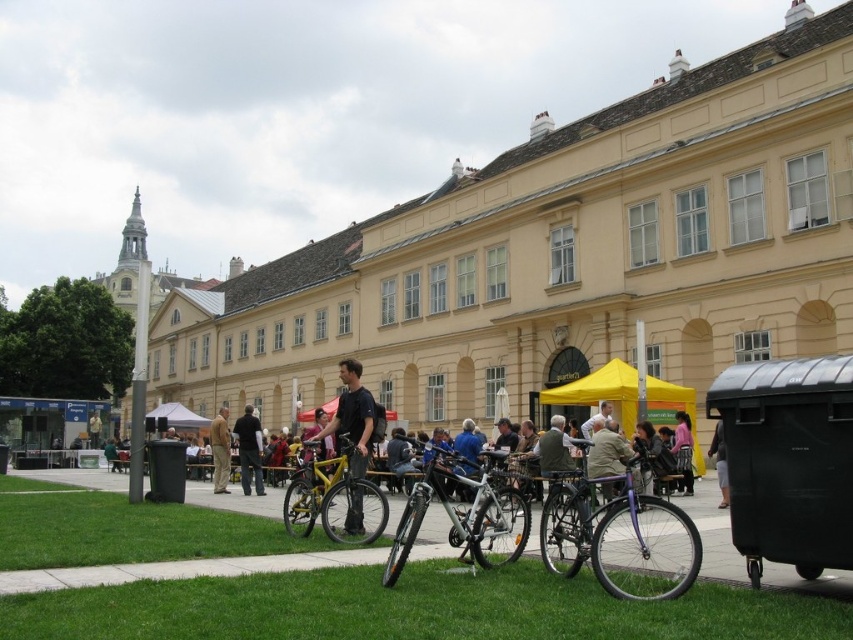
Question: Which point appears farthest from the camera in this image?

Choices:
 (A) (335, 429)
 (B) (795, 630)
 (C) (706, 486)

Answer: (C)

Question: In this image, where is shiny silver bicycle at center located relative to yellow matte bicycle at center?

Choices:
 (A) right
 (B) left

Answer: (A)

Question: From the image, what is the correct spatial relationship of matte black shirt at center in relation to dark gray jacket at center?

Choices:
 (A) right
 (B) left

Answer: (A)

Question: Estimate the real-world distances between objects in this image. Which object is closer to the matte black bicycle at center?

Choices:
 (A) yellow matte bicycle at center
 (B) tan leather jacket at center

Answer: (A)

Question: Does smooth concrete pavement at center have a smaller size compared to tan leather jacket at center?

Choices:
 (A) no
 (B) yes

Answer: (A)

Question: Which object appears farthest from the camera in this image?

Choices:
 (A) dark gray fabric pants at lower right
 (B) yellow matte bicycle at center
 (C) matte black shirt at center
 (D) shiny silver bicycle at center

Answer: (A)